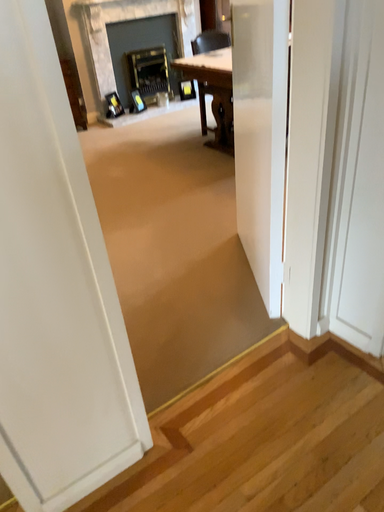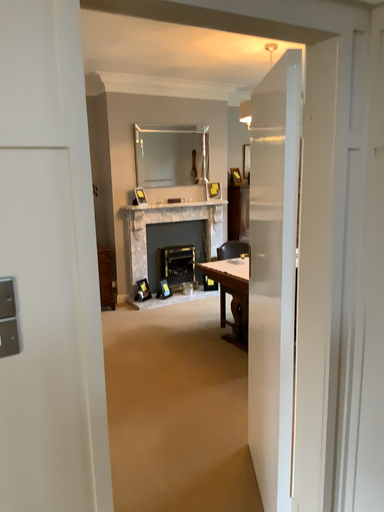
Question: Which way did the camera rotate in the video?

Choices:
 (A) rotated downward
 (B) rotated upward

Answer: (B)